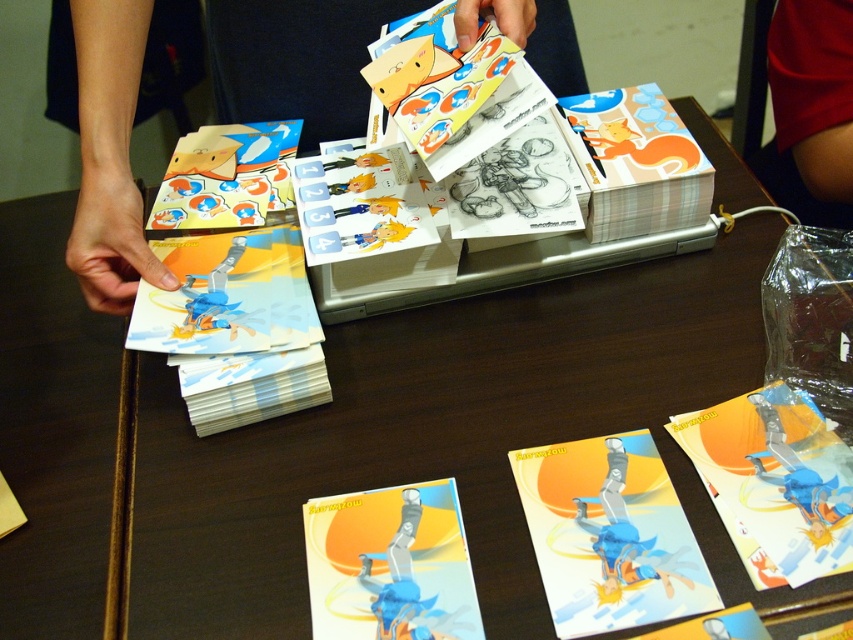
You are a card collector who wants to place a new card between the matte paper cards at center and the matte plastic cards at left. Based on their positions, which existing card group should you place it closer to?

The matte paper cards at center are in front of the matte plastic cards at left, so you should place the new card closer to the matte plastic cards at left to maintain the spatial order.

You are trying to place a new card into an existing card holder that can only accommodate cards up to the width of the matte plastic cards at left. You have the matte paper card at center. Will it fit?

The matte paper card at center is wider than the matte plastic cards at left, so it will not fit into the card holder designed for the matte plastic cards at left.

Looking at this image, you are arranging cards on a table and see two points marked on the table surface. The first point is at coordinate point[326,362] and the second is at point[115,296]. If you want to place a new card between them, which point should you move closer to ensure the new card is positioned in the middle?

To place the new card between the two points, you should position it closer to point[115,296] since point[326,362] is behind it, meaning the middle would be closer to the front point.